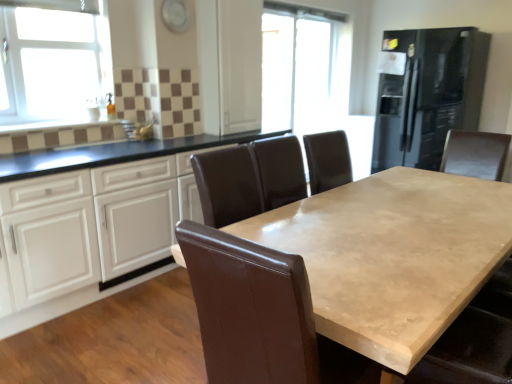
You are a GUI agent. You are given a task and a screenshot of the screen. Output one action in this format:
    pyautogui.click(x=<x>, y=<y>)
    Task: Click on the white glass window at upper left
    The width and height of the screenshot is (512, 384).
    Given the screenshot: What is the action you would take?
    pyautogui.click(x=53, y=67)

The image size is (512, 384). I want to click on white glossy cabinets at center, so click(x=94, y=234).

In order to face white glossy cabinets at center, should I rotate leftwards or rightwards?

To align with it, rotate left about 13.086°.

The image size is (512, 384). What do you see at coordinates (426, 93) in the screenshot?
I see `black glass refrigerator at right` at bounding box center [426, 93].

Locate an element on the screen. Image resolution: width=512 pixels, height=384 pixels. beige polished wood table at center is located at coordinates [392, 255].

The width and height of the screenshot is (512, 384). What do you see at coordinates (298, 67) in the screenshot? I see `transparent glass door at center` at bounding box center [298, 67].

Find the location of a particular element. This screenshot has height=384, width=512. white glass window at upper left is located at coordinates (53, 67).

Considering the positions of objects brown leather swivel chair at center and beige polished wood table at center in the image provided, who is more to the right, brown leather swivel chair at center or beige polished wood table at center?

From the viewer's perspective, beige polished wood table at center appears more on the right side.

Looking at this image, which object is wider, brown leather swivel chair at center or beige polished wood table at center?

Wider between the two is beige polished wood table at center.

Considering the sizes of brown leather swivel chair at center and beige polished wood table at center in the image, is brown leather swivel chair at center taller or shorter than beige polished wood table at center?

In the image, brown leather swivel chair at center appears to be taller than beige polished wood table at center.

Is white glossy cabinets at center facing away from transparent glass door at center?

white glossy cabinets at center does not have its back to transparent glass door at center.

Find the location of `window screen to the right of white glossy cabinets at center`. window screen to the right of white glossy cabinets at center is located at coordinates (298, 67).

From a real-world perspective, is white glossy cabinets at center physically above transparent glass door at center?

No, from a real-world perspective, white glossy cabinets at center is not over transparent glass door at center

Considering the relative sizes of black glass refrigerator at right and brown leather swivel chair at center in the image provided, is black glass refrigerator at right shorter than brown leather swivel chair at center?

No.

Between black glass refrigerator at right and brown leather swivel chair at center, which one appears on the left side from the viewer's perspective?

brown leather swivel chair at center is more to the left.

Is black glass refrigerator at right not close to brown leather swivel chair at center?

Indeed, black glass refrigerator at right is not near brown leather swivel chair at center.

Where is `fridge located behind the brown leather swivel chair at center`? Image resolution: width=512 pixels, height=384 pixels. fridge located behind the brown leather swivel chair at center is located at coordinates (426, 93).

From the picture: From a real-world perspective, between black glass refrigerator at right and white glass window at upper left, who is vertically higher?

white glass window at upper left, from a real-world perspective.

Which point is more forward, (461, 82) or (66, 71)?

The point (66, 71) is in front.

From the image's perspective, is black glass refrigerator at right below white glass window at upper left?

Actually, black glass refrigerator at right appears above white glass window at upper left in the image.

Does transparent glass door at center turn towards beige polished wood table at center?

No.

Does point (290, 40) come in front of point (343, 217)?

No, it is not.

Do you think transparent glass door at center is within beige polished wood table at center, or outside of it?

transparent glass door at center is located beyond the bounds of beige polished wood table at center.

How much distance is there between transparent glass door at center and beige polished wood table at center?

transparent glass door at center is 9.11 feet from beige polished wood table at center.

Considering the sizes of objects black glass refrigerator at right and white glossy cabinets at center in the image provided, who is shorter, black glass refrigerator at right or white glossy cabinets at center?

white glossy cabinets at center.

Is black glass refrigerator at right turned away from white glossy cabinets at center?

No, black glass refrigerator at right is not facing the opposite direction of white glossy cabinets at center.

Can white glossy cabinets at center be found inside black glass refrigerator at right?

No, white glossy cabinets at center is not a part of black glass refrigerator at right.

From the image's perspective, would you say black glass refrigerator at right is shown under white glossy cabinets at center?

No, from the image's perspective, black glass refrigerator at right is not beneath white glossy cabinets at center.

Consider the image. Considering the relative sizes of brown leather swivel chair at center and black glass refrigerator at right in the image provided, is brown leather swivel chair at center taller than black glass refrigerator at right?

Incorrect, the height of brown leather swivel chair at center is not larger of that of black glass refrigerator at right.

Is brown leather swivel chair at center aimed at black glass refrigerator at right?

No, brown leather swivel chair at center is not oriented towards black glass refrigerator at right.

Is brown leather swivel chair at center outside of black glass refrigerator at right?

Yes, brown leather swivel chair at center is outside of black glass refrigerator at right.

In the image, there is a brown leather swivel chair at center. Where is `table below it (from the image's perspective)`? The height and width of the screenshot is (384, 512). table below it (from the image's perspective) is located at coordinates (392, 255).

The image size is (512, 384). What are the coordinates of `cabinetry in front of the transparent glass door at center` in the screenshot? It's located at (94, 234).

Which object lies further to the anchor point black glass refrigerator at right, white glass window at upper left or beige polished wood table at center?

white glass window at upper left lies further to black glass refrigerator at right than the other object.

Looking at this image, considering their positions, is white glass window at upper left positioned closer to transparent glass door at center than black glass refrigerator at right?

black glass refrigerator at right is positioned closer to the anchor transparent glass door at center.

Based on their spatial positions, is black glass refrigerator at right or white glossy cabinets at center closer to transparent glass door at center?

black glass refrigerator at right is positioned closer to the anchor transparent glass door at center.

Based on their spatial positions, is white glass window at upper left or black glass refrigerator at right closer to beige polished wood table at center?

The object closer to beige polished wood table at center is white glass window at upper left.

From the image, which object appears to be farther from brown leather swivel chair at center, beige polished wood table at center or transparent glass door at center?

transparent glass door at center is positioned further to the anchor brown leather swivel chair at center.

Considering their positions, is white glass window at upper left positioned further to transparent glass door at center than brown leather swivel chair at center?

brown leather swivel chair at center is further to transparent glass door at center.

Looking at the image, which one is located closer to white glossy cabinets at center, transparent glass door at center or brown leather swivel chair at center?

brown leather swivel chair at center is positioned closer to the anchor white glossy cabinets at center.

Estimate the real-world distances between objects in this image. Which object is closer to beige polished wood table at center, white glass window at upper left or white glossy cabinets at center?

white glossy cabinets at center.

The height and width of the screenshot is (384, 512). I want to click on swivel chair between white glass window at upper left and black glass refrigerator at right, so click(250, 308).

The height and width of the screenshot is (384, 512). In order to click on fridge between beige polished wood table at center and transparent glass door at center along the z-axis in this screenshot , I will do `click(426, 93)`.

Locate an element on the screen. This screenshot has width=512, height=384. cabinetry situated between white glass window at upper left and brown leather swivel chair at center from left to right is located at coordinates (94, 234).

Locate an element on the screen. swivel chair between white glossy cabinets at center and beige polished wood table at center from left to right is located at coordinates [250, 308].